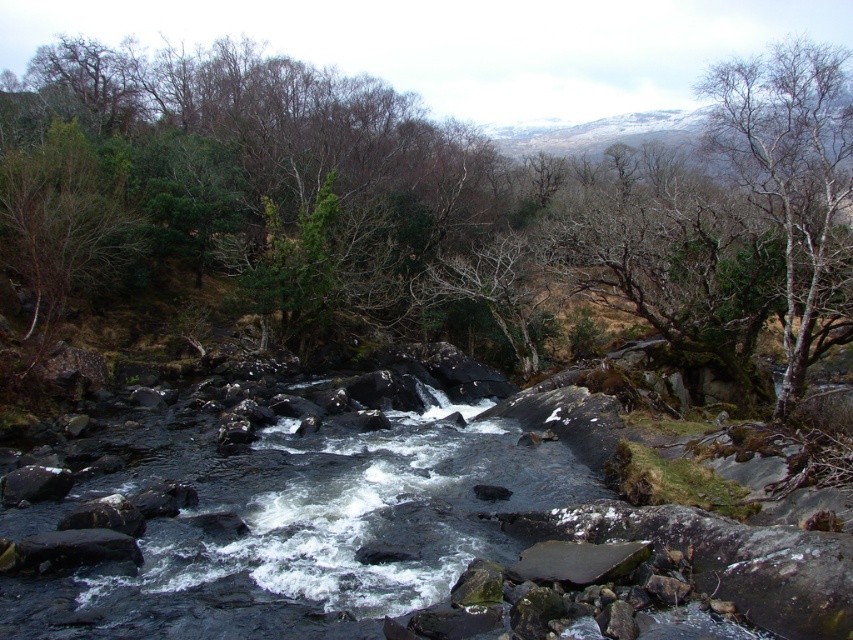
Question: Which object appears closest to the camera in this image?

Choices:
 (A) green leafy tree at center
 (B) bare bark tree at upper right

Answer: (B)

Question: Which point is closer to the camera?

Choices:
 (A) green leafy tree at center
 (B) bare bark tree at upper right

Answer: (B)

Question: Is green leafy tree at center below bare bark tree at upper right?

Choices:
 (A) yes
 (B) no

Answer: (B)

Question: Does green leafy tree at center appear under bare bark tree at upper right?

Choices:
 (A) no
 (B) yes

Answer: (A)

Question: Is green leafy tree at center to the right of bare bark tree at upper right from the viewer's perspective?

Choices:
 (A) no
 (B) yes

Answer: (A)